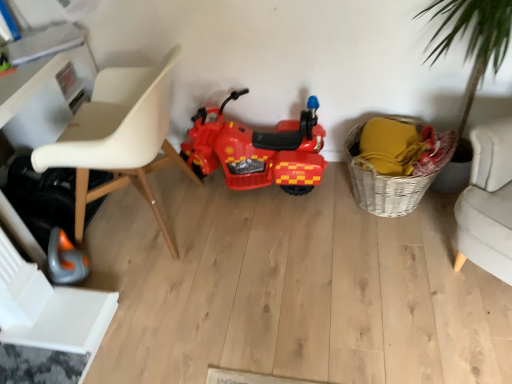
The image size is (512, 384). I want to click on vacant space that is in between shiny plastic motorcycle at center and woven basket at lower right, so click(309, 200).